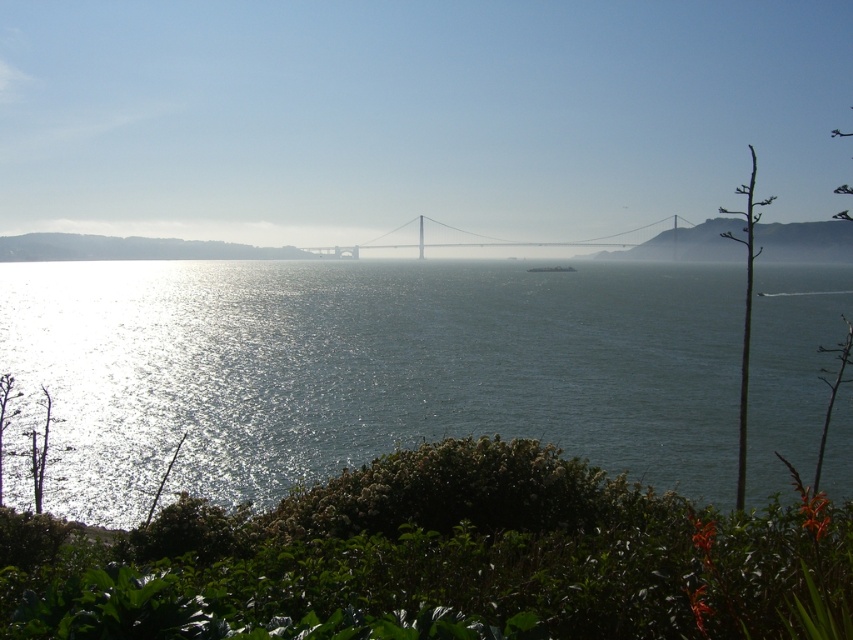
Question: Is glistening water at center closer to camera compared to green leafy bush at lower center?

Choices:
 (A) yes
 (B) no

Answer: (B)

Question: Among these points, which one is nearest to the camera?

Choices:
 (A) (370, 243)
 (B) (618, 532)

Answer: (B)

Question: Does glistening water at center have a larger size compared to green leafy bush at lower center?

Choices:
 (A) no
 (B) yes

Answer: (B)

Question: Which point is farther to the camera?

Choices:
 (A) glistening water at center
 (B) metallic golden bridge at center
 (C) green leafy bush at lower center

Answer: (B)

Question: Is glistening water at center wider than metallic golden bridge at center?

Choices:
 (A) yes
 (B) no

Answer: (A)

Question: Which point is farther to the camera?

Choices:
 (A) (393, 426)
 (B) (711, 568)
 (C) (408, 244)

Answer: (C)